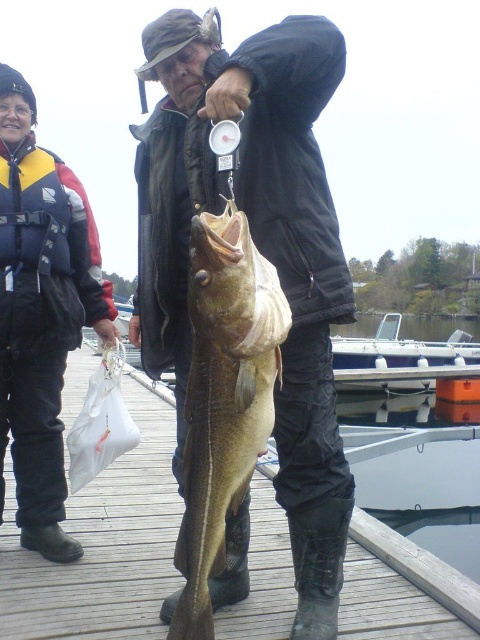
You are a photographer trying to capture both the matte black jacket at center and the black nylon jacket at left in a single frame. Given their sizes, which jacket will appear larger in the photo?

The black nylon jacket at left will appear larger in the photo because it has a bigger size than the matte black jacket at center.

You are standing on the wooden dock and want to hand a fishing rod to both the matte black jacket at center and the black nylon jacket at left. Based on their positions, which jacket should you approach first to give the fishing rod?

The matte black jacket at center is located below the black nylon jacket at left, so you should approach the black nylon jacket at left first since they are higher up and closer to your current position on the dock.